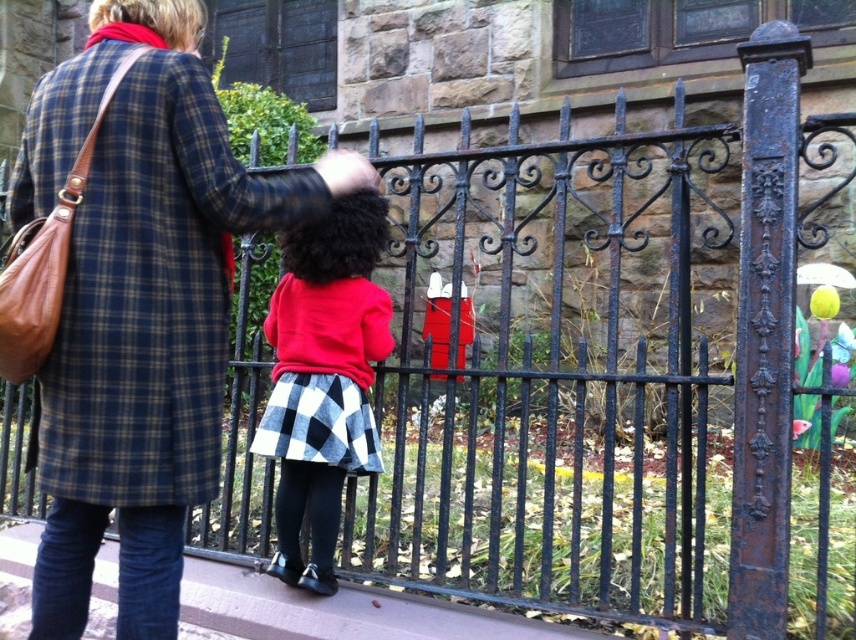
You are trying to determine which clothing item is bigger between the plaid wool coat at upper left and the red wool sweater at center. Based on the scene, which one is larger?

The plaid wool coat at upper left is larger than the red wool sweater at center.

You are a photographer trying to capture a clear photo of the red wool sweater at center without the plaid wool coat at upper left blocking it. What adjustment should you make to your camera angle?

The plaid wool coat at upper left is positioned over the red wool sweater at center, so you should lower your camera angle to avoid the plaid wool coat at upper left blocking the view of the red wool sweater at center.

You are standing 5 feet away from the camera. Can you reach the plaid wool coat at upper left without moving?

The plaid wool coat at upper left is 3.79 feet away from the camera. Since you are 5 feet away from the camera, you are further away than the coat, so you cannot reach it without moving closer.